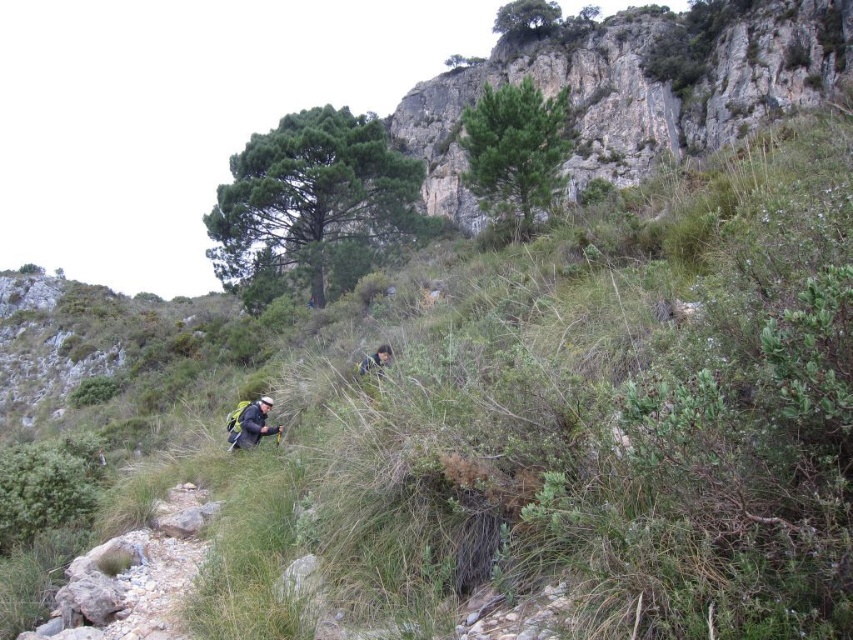
Question: Is rough textured rock at upper center above camouflage fabric person at lower center?

Choices:
 (A) yes
 (B) no

Answer: (A)

Question: Which point is farther from the camera taking this photo?

Choices:
 (A) (762, 61)
 (B) (376, 353)

Answer: (A)

Question: Which point is closer to the camera?

Choices:
 (A) rough textured rock at upper center
 (B) dark gray jacket at lower left
 (C) camouflage fabric person at lower center

Answer: (B)

Question: Is dark gray jacket at lower left further to camera compared to camouflage fabric person at lower center?

Choices:
 (A) no
 (B) yes

Answer: (A)

Question: Is the position of rough textured rock at upper center more distant than that of camouflage fabric person at lower center?

Choices:
 (A) yes
 (B) no

Answer: (A)

Question: Which is farther from the dark gray jacket at lower left?

Choices:
 (A) camouflage fabric person at lower center
 (B) rough textured rock at upper center

Answer: (B)